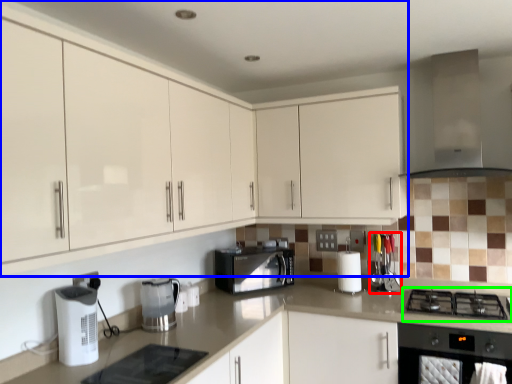
Question: Which object is the farthest from appliance (highlighted by a red box)? Choose among these: cabinetry (highlighted by a blue box) or gas stove (highlighted by a green box).

Choices:
 (A) cabinetry
 (B) gas stove

Answer: (A)